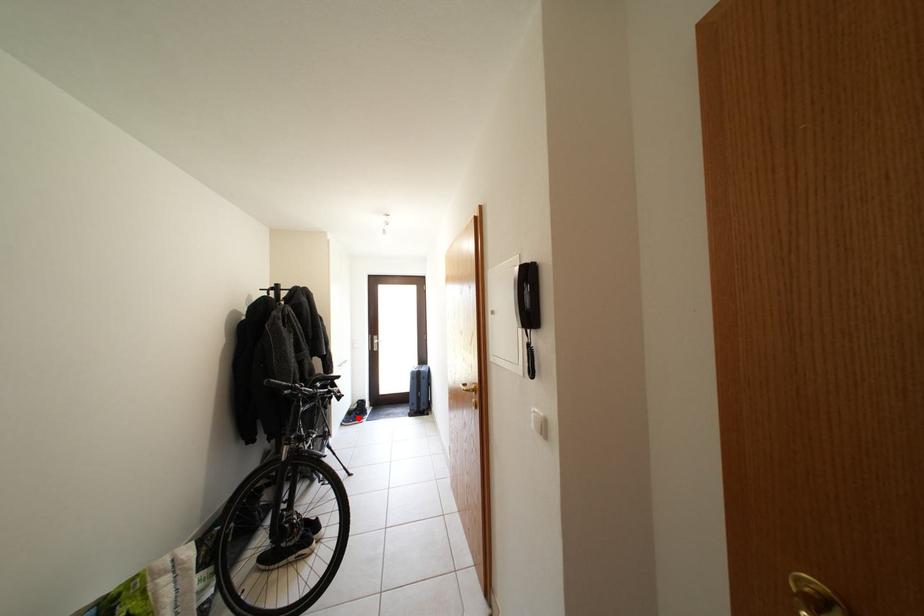
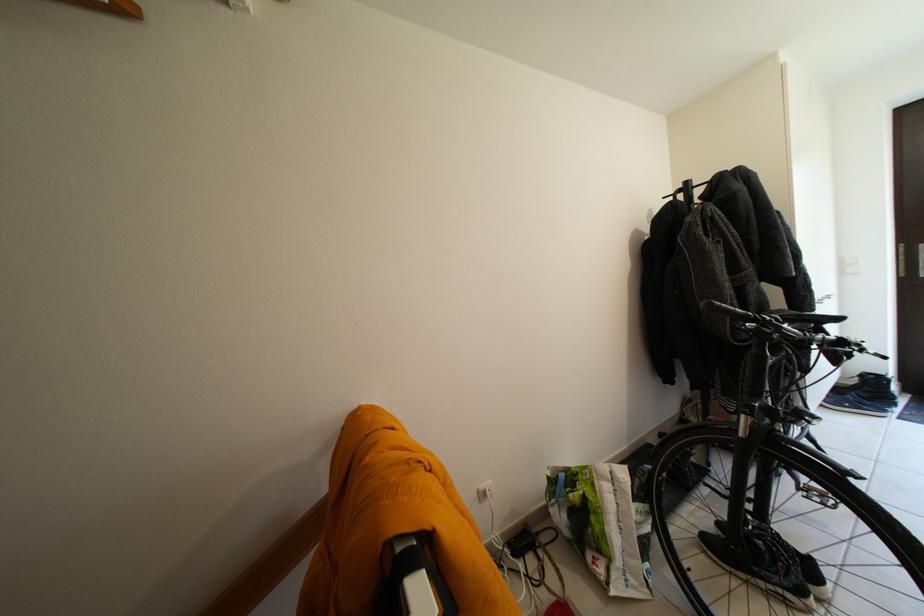
Question: I am providing you with two images of the same scene from different viewpoints. Given a red point in image1, look at the same physical point in image2. Is it:

Choices:
 (A) Closer to the viewpoint
 (B) Farther from the viewpoint

Answer: (A)